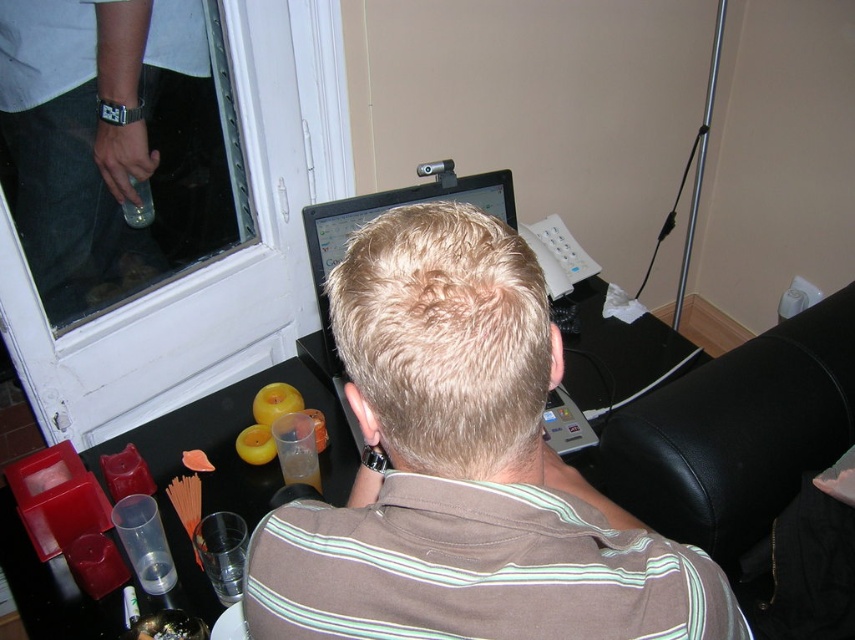
You are a photographer taking a picture of the scene. You notice the brown striped shirt at center and the black plastic monitor at center. Which object is shorter in height?

The brown striped shirt at center is shorter in height than the black plastic monitor at center.

You are a delivery robot with a package that needs to be placed between the brown striped shirt at center and the black plastic monitor at center. The package is 30 inches long. Can you fit the package between them without moving either object?

The distance between the brown striped shirt at center and the black plastic monitor at center is 29.05 inches. Since the package is 30 inches long, it cannot fit between them as it is slightly longer than the available space.

You are the person sitting at the desk in the image. You want to reach for an object located at point A and another at point B. If point A is at coordinates point (x=844, y=420) and point B is at point (x=323, y=269), which point is closer to your body?

Point A at coordinates point (x=844, y=420) is in front of point B at point (x=323, y=269), so it is closer to your body.